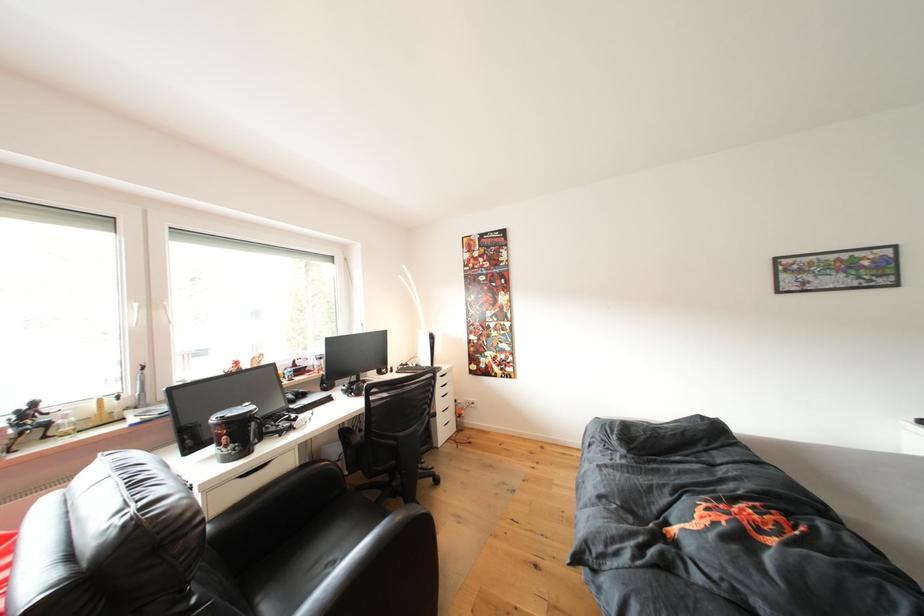
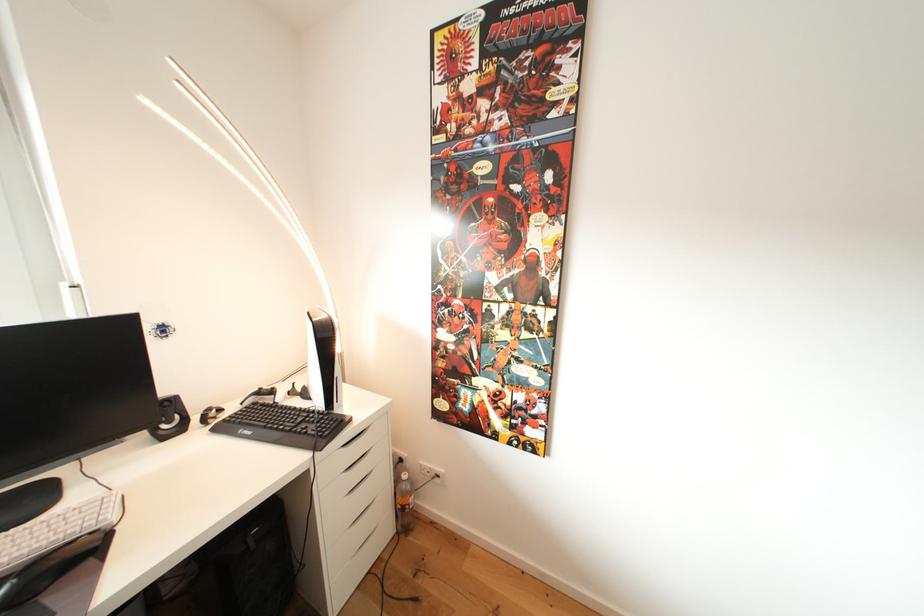
In the second image, find the point that corresponds to pixel 410 370 in the first image.

(268, 398)